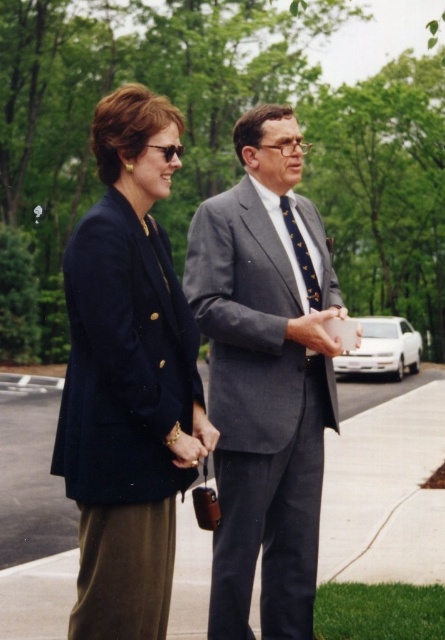
Question: Is navy blue blazer at left thinner than gray concrete pavement at center?

Choices:
 (A) yes
 (B) no

Answer: (A)

Question: Which point is closer to the camera?

Choices:
 (A) (88, 620)
 (B) (315, 273)
 (C) (368, 403)

Answer: (A)

Question: Is the position of gray concrete pavement at center less distant than that of dark blue textured tie at center?

Choices:
 (A) no
 (B) yes

Answer: (A)

Question: Which point is closer to the camera?

Choices:
 (A) (133, 428)
 (B) (287, 544)

Answer: (A)

Question: Is navy blue blazer at left positioned in front of dark blue textured tie at center?

Choices:
 (A) yes
 (B) no

Answer: (A)

Question: Which object appears farthest from the camera in this image?

Choices:
 (A) dark blue textured tie at center
 (B) gray concrete pavement at center
 (C) navy blue blazer at left

Answer: (B)